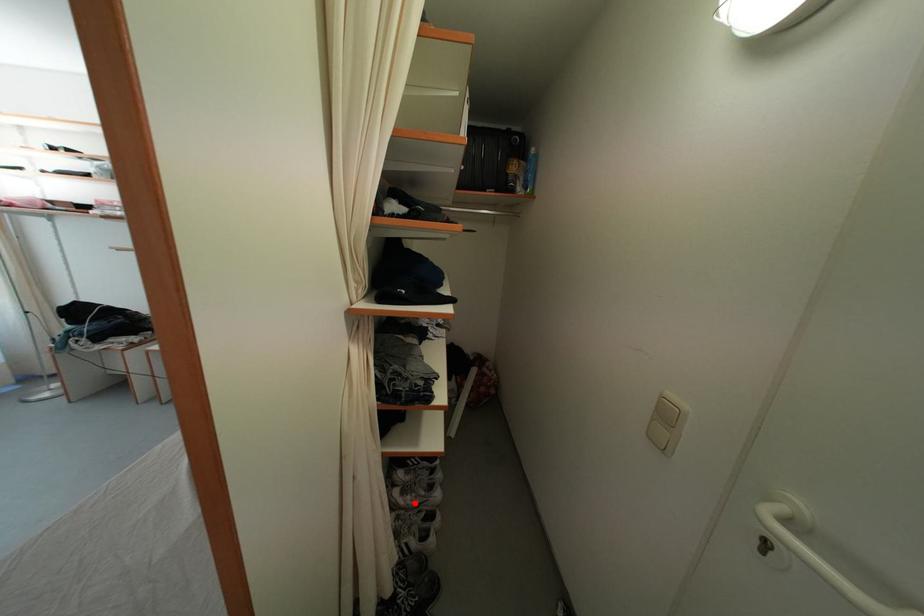
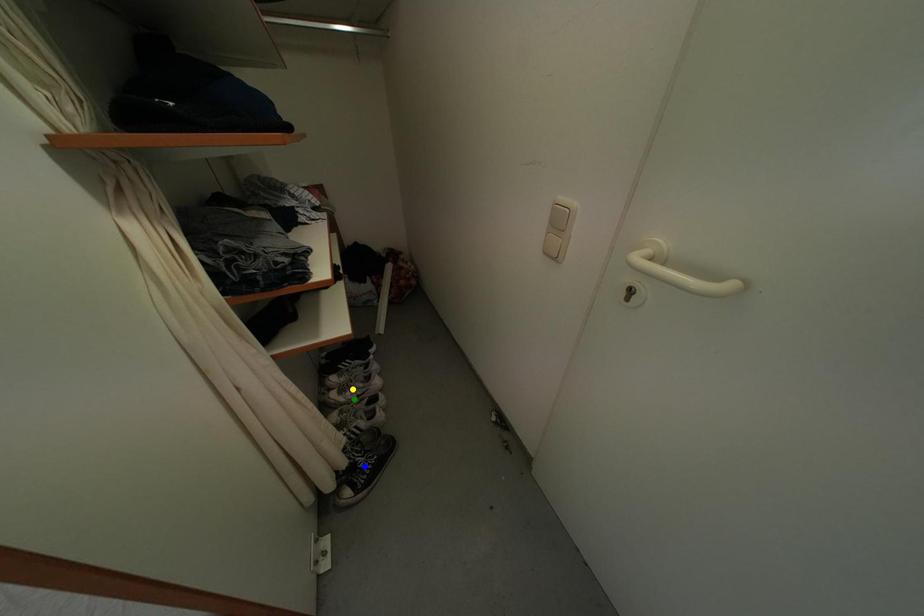
Question: I am providing you with two images of the same scene from different viewpoints. A red point is marked on the first image. You are given multiple points on the second image. In image 2, which mark is for the same physical point as the one in image 1?

Choices:
 (A) yellow point
 (B) green point
 (C) blue point

Answer: (B)